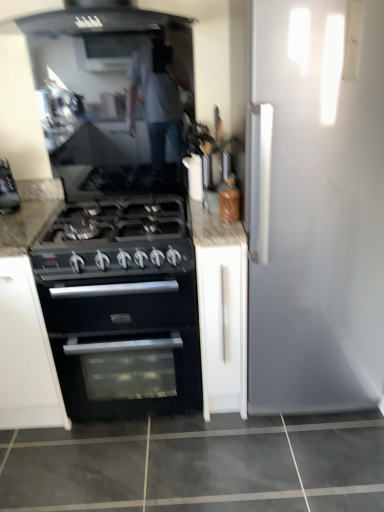
Question: Is point (170, 355) closer or farther from the camera than point (82, 225)?

Choices:
 (A) farther
 (B) closer

Answer: (A)

Question: Relative to black matte gas stove at center, is black matte oven at center in front or behind?

Choices:
 (A) front
 (B) behind

Answer: (B)

Question: Based on their relative distances, which object is farther from the white matte cabinet at center?

Choices:
 (A) black matte gas stove at center
 (B) black matte oven at center

Answer: (A)

Question: Estimate the real-world distances between objects in this image. Which object is farther from the black matte oven at center?

Choices:
 (A) white matte cabinet at center
 (B) black matte gas stove at center

Answer: (B)